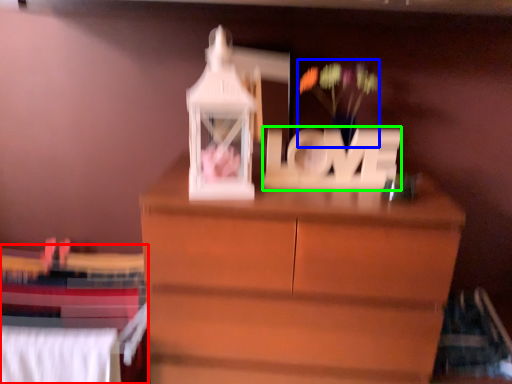
Question: Which object is positioned closest to bed (highlighted by a red box)? Select from floral arrangement (highlighted by a blue box) and letter (highlighted by a green box).

Choices:
 (A) floral arrangement
 (B) letter

Answer: (B)